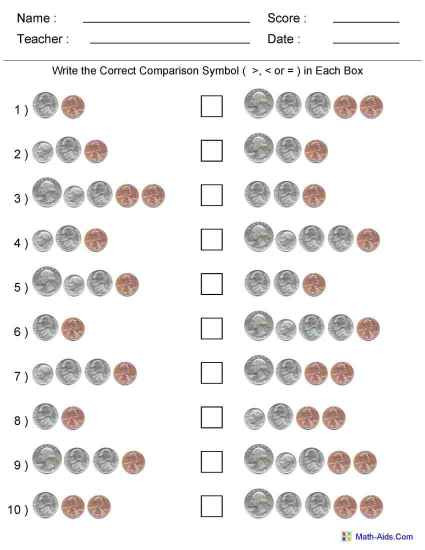
Find the location of a particular element. This screenshot has height=550, width=425. boxes is located at coordinates (212, 507), (212, 455), (212, 421), (211, 324), (212, 373), (212, 286), (209, 243), (210, 201), (212, 155), (209, 101).